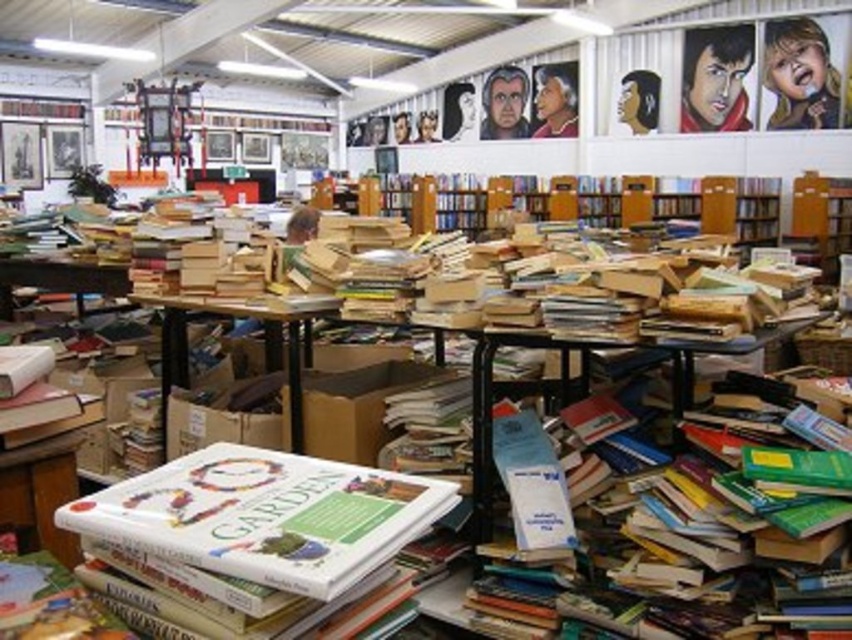
You are standing in the middle of the cluttered indoor space and want to pick up an item. There are two points marked in the scene. Which point is closer to you, point (532,449) or point (262,516)?

Point (262,516) is closer to you because the description states that point (532,449) is further to the camera than point (262,516).

You are standing in the middle of a chaotic bookstore and see a hardcover book at center. Can you estimate its position relative to the room?

The hardcover book at center is located at the coordinates 0.806 on the x axis and 0.312 on the y axis.